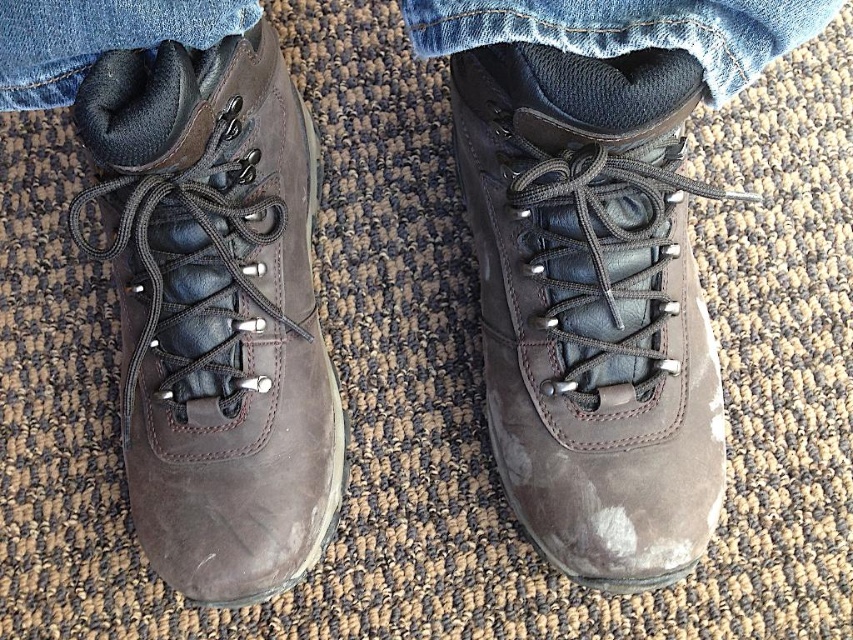
You are trying to determine if the denim at center and denim at left can fit into a rectangular storage box that is 1 meter wide. Based on their widths, which one has a greater chance of fitting without bending?

The denim at center might be wider than denim at left, so the denim at left has a greater chance of fitting into the 1 meter wide storage box without bending.

Where is the brown suede boot at center located in the image?

The brown suede boot at center is located at point (592, 305) in the image.

You are standing in a room and see the denim at center. If you want to place a small object exactly at point 0.047, 0.737, where should you place it?

The denim at center is located at point (628, 29), so you should place the small object there.